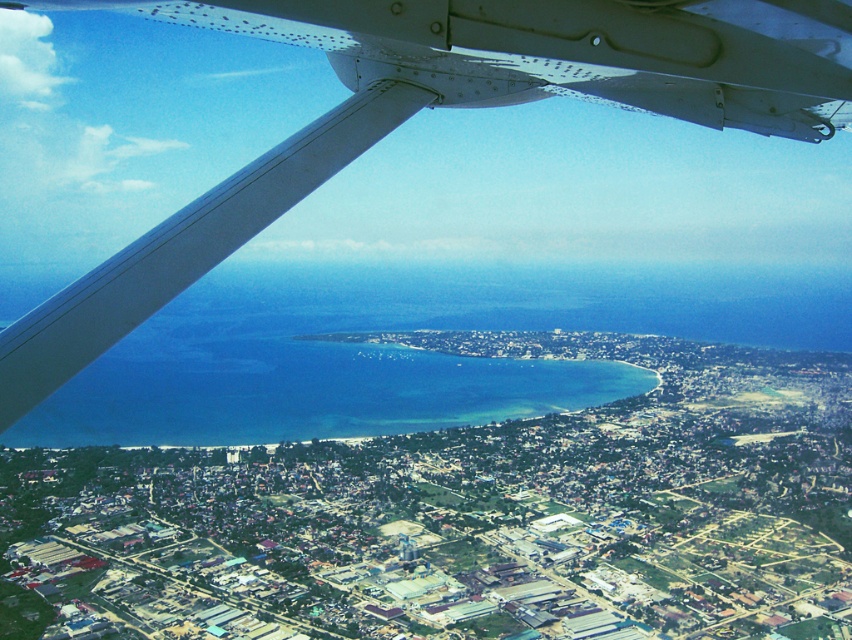
Who is more distant from viewer, (317, 310) or (133, 348)?

The point (133, 348) is behind.

Consider the image. Measure the distance between point (609, 282) and camera.

643.29 meters

I want to click on white matte wing at upper left, so click(482, 276).

Where is `white matte wing at upper left`? white matte wing at upper left is located at coordinates (482, 276).